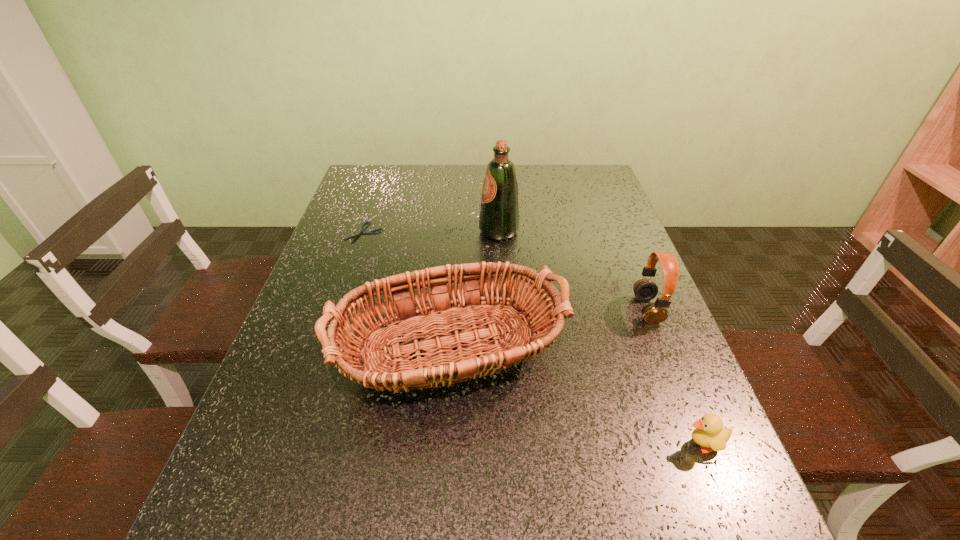
You are a GUI agent. You are given a task and a screenshot of the screen. Output one action in this format:
    pyautogui.click(x=<x>, y=<y>)
    Task: Click on the olive oil
    Image resolution: width=960 pixels, height=540 pixels.
    Given the screenshot: What is the action you would take?
    pyautogui.click(x=499, y=214)

Identify the location of basket. (546, 316).

Where is `the third shortest object`? This screenshot has height=540, width=960. the third shortest object is located at coordinates (645, 289).

This screenshot has height=540, width=960. What are the coordinates of `the second shortest object` in the screenshot? It's located at (709, 433).

At what (x,y) coordinates should I click in order to perform the action: click on the shortest object. Please return your answer as a coordinate pair (x, y). This screenshot has height=540, width=960. Looking at the image, I should click on (369, 232).

The height and width of the screenshot is (540, 960). I want to click on vacant space located on the front-facing side of the olive oil, so click(x=341, y=232).

In order to click on vacant space located on the front-facing side of the olive oil in this screenshot , I will do `click(410, 232)`.

The width and height of the screenshot is (960, 540). I want to click on free space located 0.370m on the front-facing side of the olive oil, so click(x=351, y=232).

At what (x,y) coordinates should I click in order to perform the action: click on vacant space located 0.050m on the back of the second tallest object. Please return your answer as a coordinate pair (x, y). The height and width of the screenshot is (540, 960). Looking at the image, I should click on (446, 271).

Find the location of a particular element. The image size is (960, 540). free space located 0.340m on the ear cups of the headset is located at coordinates (491, 309).